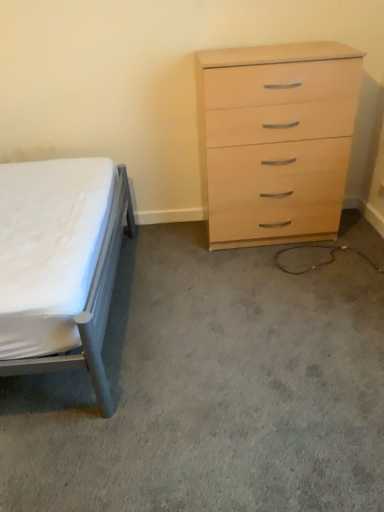
Question: Does white fabric bed at left lie in front of matte gray bed at left?

Choices:
 (A) no
 (B) yes

Answer: (A)

Question: From the image's perspective, is white fabric bed at left on matte gray bed at left?

Choices:
 (A) no
 (B) yes

Answer: (A)

Question: Can you confirm if white fabric bed at left is positioned to the left of matte gray bed at left?

Choices:
 (A) yes
 (B) no

Answer: (B)

Question: Is white fabric bed at left far away from matte gray bed at left?

Choices:
 (A) no
 (B) yes

Answer: (A)

Question: Considering the relative sizes of white fabric bed at left and matte gray bed at left in the image provided, is white fabric bed at left smaller than matte gray bed at left?

Choices:
 (A) no
 (B) yes

Answer: (B)

Question: Considering the relative sizes of white fabric bed at left and matte gray bed at left in the image provided, is white fabric bed at left shorter than matte gray bed at left?

Choices:
 (A) no
 (B) yes

Answer: (B)

Question: Considering the relative positions of matte gray bed at left and light wood/veneer chest of drawers at right in the image provided, is matte gray bed at left behind light wood/veneer chest of drawers at right?

Choices:
 (A) yes
 (B) no

Answer: (B)

Question: Can you confirm if matte gray bed at left is wider than light wood/veneer chest of drawers at right?

Choices:
 (A) no
 (B) yes

Answer: (B)

Question: Does matte gray bed at left have a larger size compared to light wood/veneer chest of drawers at right?

Choices:
 (A) yes
 (B) no

Answer: (A)

Question: Does matte gray bed at left have a lesser width compared to light wood/veneer chest of drawers at right?

Choices:
 (A) yes
 (B) no

Answer: (B)

Question: Does matte gray bed at left have a smaller size compared to light wood/veneer chest of drawers at right?

Choices:
 (A) no
 (B) yes

Answer: (A)

Question: From a real-world perspective, is matte gray bed at left under light wood/veneer chest of drawers at right?

Choices:
 (A) yes
 (B) no

Answer: (A)

Question: Is light wood/veneer chest of drawers at right positioned with its back to matte gray bed at left?

Choices:
 (A) yes
 (B) no

Answer: (B)